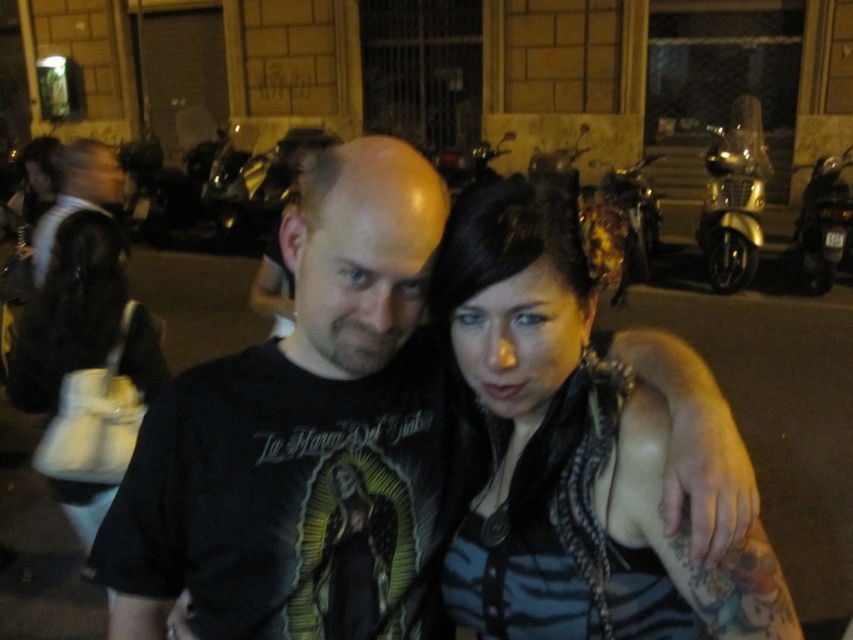
Question: Which object is closer to the camera taking this photo?

Choices:
 (A) dark brown leather jacket at center
 (B) black matte shirt at center
 (C) black leather jacket at left

Answer: (B)

Question: Which of the following is the farthest from the observer?

Choices:
 (A) metallic silver scooter at right
 (B) gold metallic scooter at upper right
 (C) black leather jacket at left
 (D) black matte shirt at center

Answer: (B)

Question: Where is black matte shirt at center located in relation to metallic silver scooter at right in the image?

Choices:
 (A) left
 (B) right

Answer: (A)

Question: Does white leather purse at left have a greater width compared to metallic silver scooter at right?

Choices:
 (A) yes
 (B) no

Answer: (B)

Question: Among these objects, which one is nearest to the camera?

Choices:
 (A) gold metallic scooter at upper right
 (B) black matte shirt at center
 (C) white leather purse at left

Answer: (B)

Question: Does black matte shirt at center appear under white leather purse at left?

Choices:
 (A) no
 (B) yes

Answer: (A)